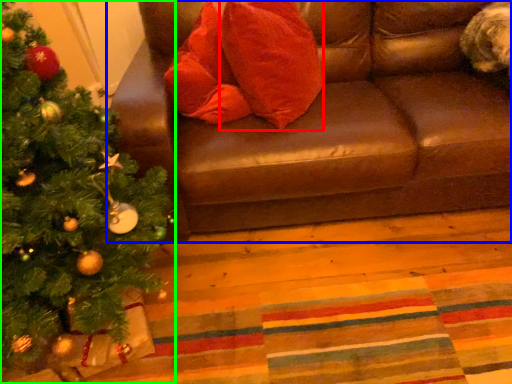
Question: Which is nearer to the throw pillow (highlighted by a red box)? studio couch (highlighted by a blue box) or christmas tree (highlighted by a green box).

Choices:
 (A) studio couch
 (B) christmas tree

Answer: (A)